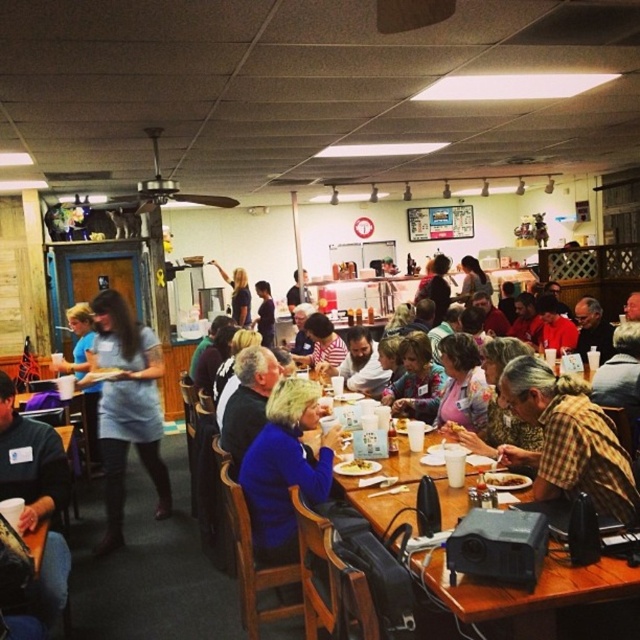
Which of these two, wooden table at center or matte blue dress at left, stands taller?

matte blue dress at left

This screenshot has height=640, width=640. Describe the element at coordinates (550, 602) in the screenshot. I see `wooden table at center` at that location.

Which is behind, point (448, 516) or point (112, 336)?

The point (112, 336) is more distant.

This screenshot has height=640, width=640. I want to click on wooden table at center, so click(x=550, y=602).

Who is taller, brown plaid shirt at lower right or light blue shirt at center?

light blue shirt at center

Find the location of a particular element. The width and height of the screenshot is (640, 640). brown plaid shirt at lower right is located at coordinates (566, 440).

What do you see at coordinates (29, 461) in the screenshot? I see `dark blue shirt at lower left` at bounding box center [29, 461].

Is point (56, 506) less distant than point (262, 321)?

That is True.

Where is `dark blue shirt at lower left`? Image resolution: width=640 pixels, height=640 pixels. dark blue shirt at lower left is located at coordinates (29, 461).